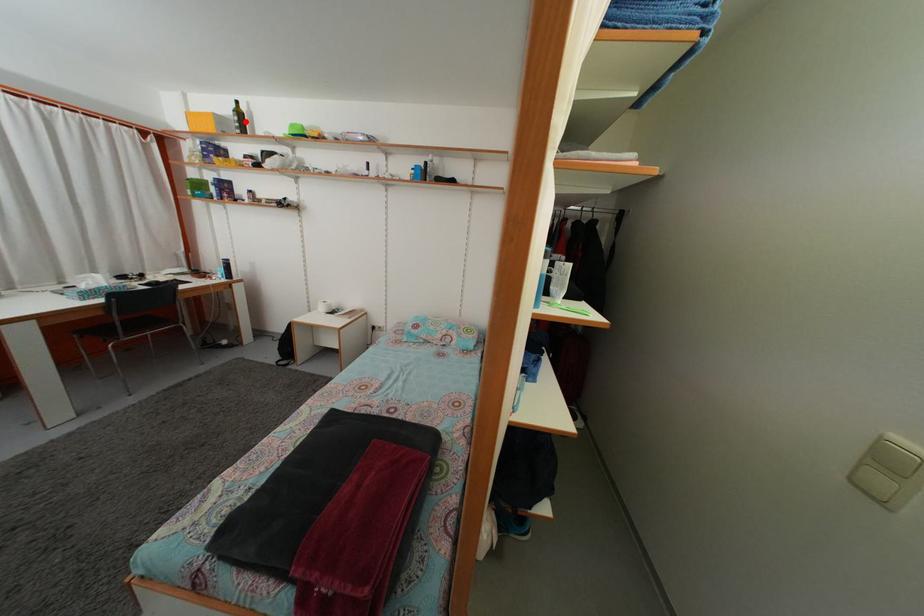
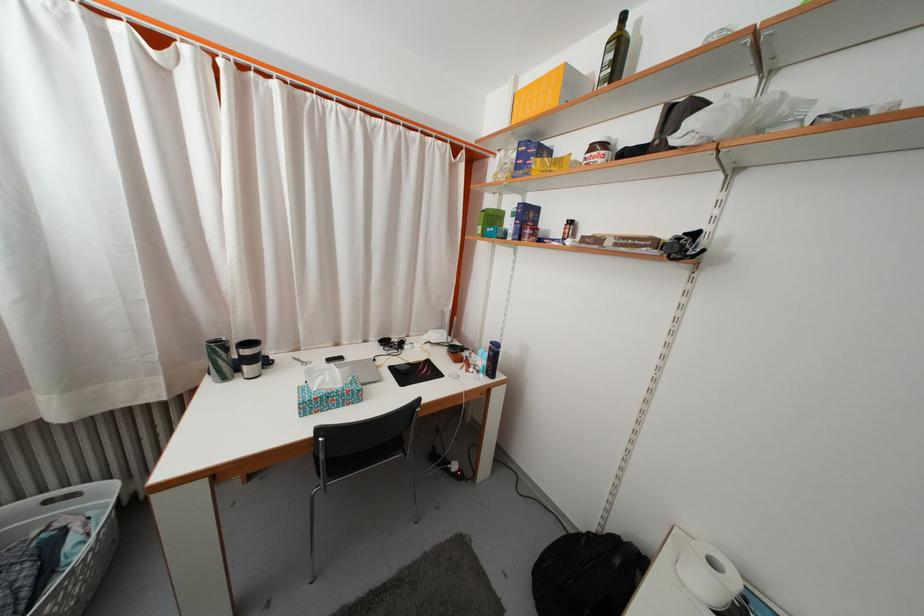
In the second image, find the point that corresponds to the highlighted location in the first image.

(625, 54)